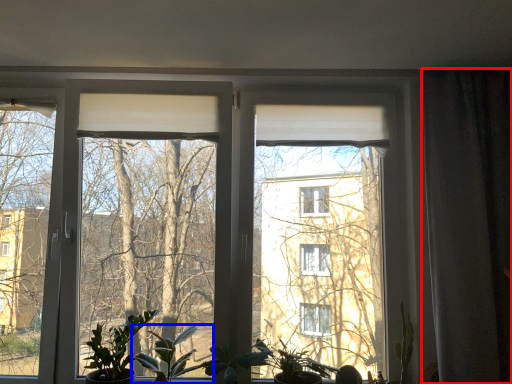
Question: Which point is further to the camera, curtain (highlighted by a red box) or houseplant (highlighted by a blue box)?

Choices:
 (A) curtain
 (B) houseplant

Answer: (A)